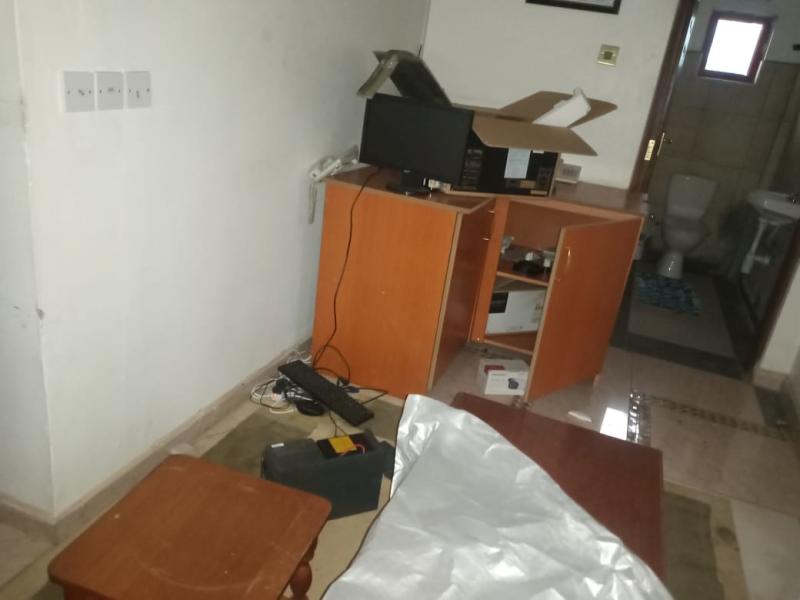
Where is `rug`? The height and width of the screenshot is (600, 800). rug is located at coordinates (681, 300).